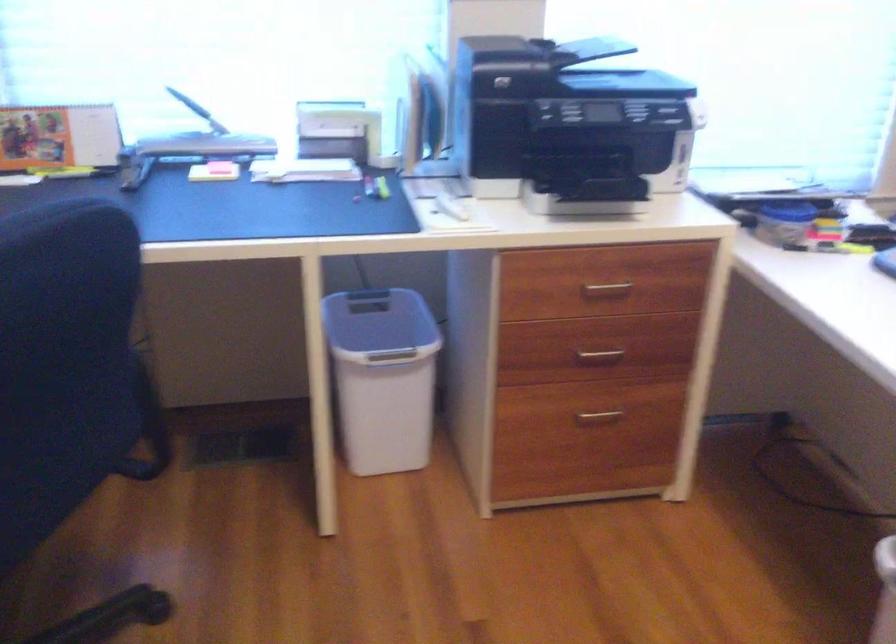
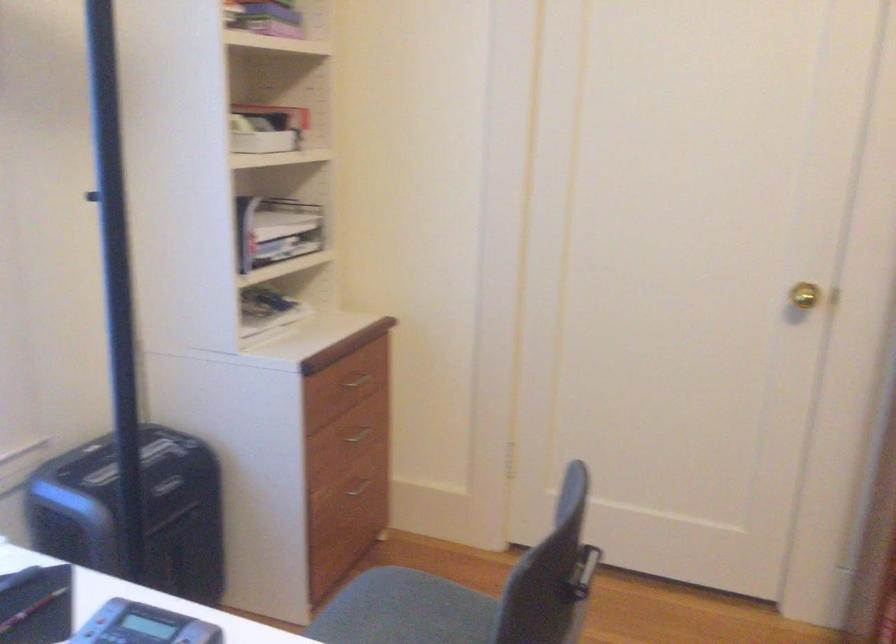
Question: The camera is either moving clockwise (left) or counter-clockwise (right) around the object. The first image is from the beginning of the video and the second image is from the end. Is the camera moving left or right when shooting the video?

Choices:
 (A) Left
 (B) Right

Answer: (A)